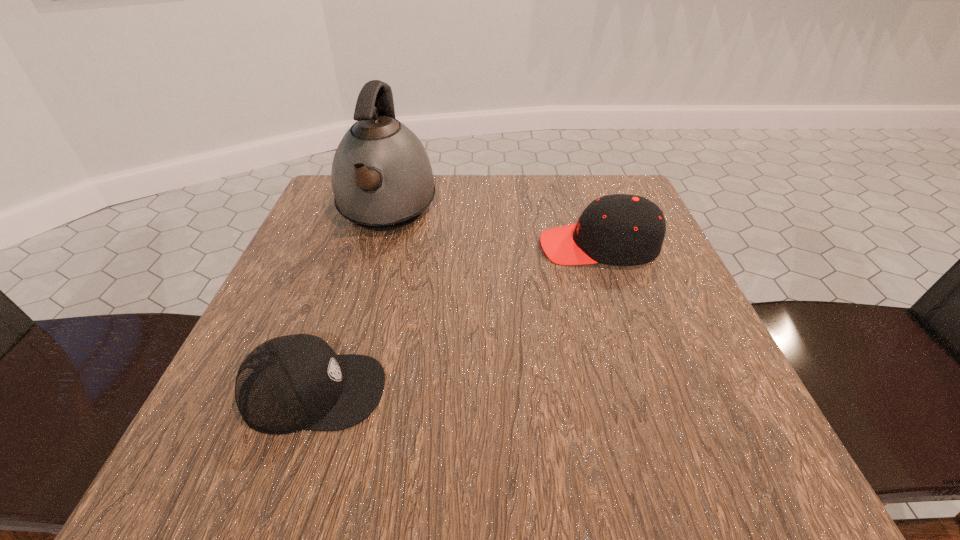
The width and height of the screenshot is (960, 540). In order to click on kettle situated at the far edge in this screenshot , I will do `click(382, 179)`.

You are a GUI agent. You are given a task and a screenshot of the screen. Output one action in this format:
    pyautogui.click(x=<x>, y=<y>)
    Task: Click on the cap present at the far edge
    The height and width of the screenshot is (540, 960).
    Given the screenshot: What is the action you would take?
    pyautogui.click(x=620, y=229)

Where is `object present at the near edge`? object present at the near edge is located at coordinates (290, 383).

Image resolution: width=960 pixels, height=540 pixels. I want to click on kettle present at the left edge, so click(382, 179).

Find the location of `cap that is at the left edge`. cap that is at the left edge is located at coordinates pyautogui.click(x=290, y=383).

This screenshot has height=540, width=960. In order to click on object at the right edge in this screenshot , I will do `click(620, 229)`.

This screenshot has height=540, width=960. What are the coordinates of `object located at the far left corner` in the screenshot? It's located at [x=382, y=179].

Find the location of `object situated at the near left corner`. object situated at the near left corner is located at coordinates (290, 383).

The image size is (960, 540). I want to click on object at the far right corner, so click(620, 229).

This screenshot has width=960, height=540. What are the coordinates of `free location at the far edge` in the screenshot? It's located at (438, 192).